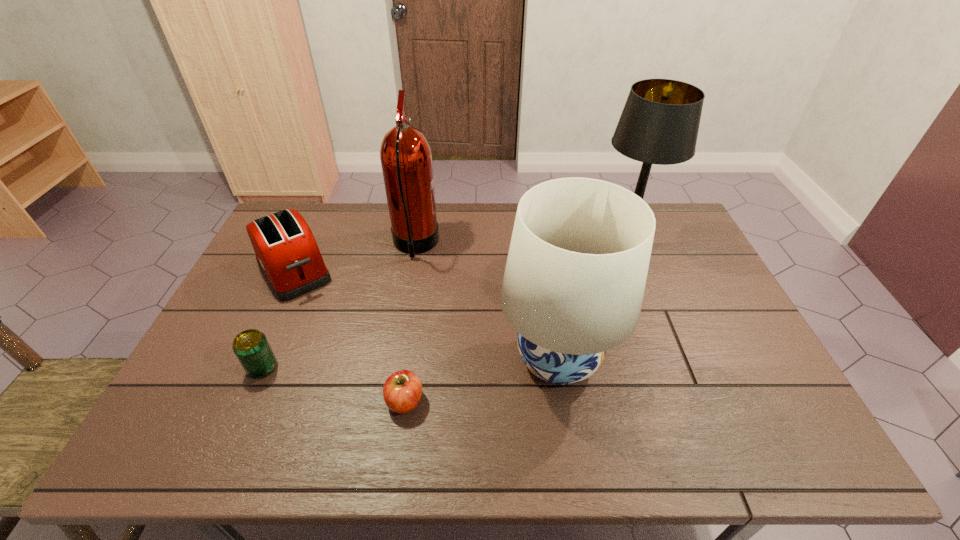
Find the location of `vacant space situated 0.130m on the front-facing side of the second object from right to left`. vacant space situated 0.130m on the front-facing side of the second object from right to left is located at coordinates (448, 359).

Where is `free space located on the back of the third shortest object`? This screenshot has width=960, height=540. free space located on the back of the third shortest object is located at coordinates (323, 210).

Identify the location of vacant area situated 0.170m on the front of the beer can. (229, 445).

The height and width of the screenshot is (540, 960). What are the coordinates of `vacant area situated 0.190m on the right of the shortest object` in the screenshot? It's located at (502, 401).

Where is `table lamp at the far edge`? table lamp at the far edge is located at coordinates (659, 124).

Where is `fire extinguisher located in the far edge section of the desktop`? This screenshot has width=960, height=540. fire extinguisher located in the far edge section of the desktop is located at coordinates (406, 159).

You are a GUI agent. You are given a task and a screenshot of the screen. Output one action in this format:
    pyautogui.click(x=<x>, y=<y>)
    Task: Click on the toaster present at the left edge
    This screenshot has height=540, width=960.
    Given the screenshot: What is the action you would take?
    pyautogui.click(x=286, y=251)

This screenshot has width=960, height=540. I want to click on beer can at the left edge, so click(x=251, y=347).

Locate an element on the screen. object present at the right edge is located at coordinates (659, 124).

At what (x,y) coordinates should I click in order to perform the action: click on object situated at the far right corner. Please return your answer as a coordinate pair (x, y). Looking at the image, I should click on (659, 124).